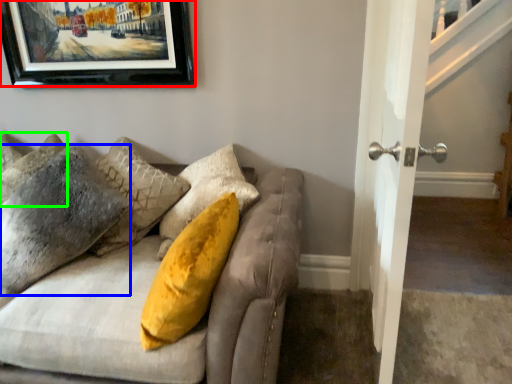
Question: Considering the real-world distances, which object is closest to picture frame (highlighted by a red box)? pillow (highlighted by a blue box) or pillow (highlighted by a green box).

Choices:
 (A) pillow
 (B) pillow

Answer: (B)